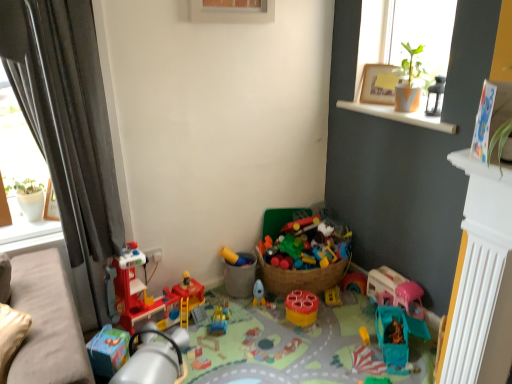
Locate an element on the screen. The width and height of the screenshot is (512, 384). free space behind translucent plastic slide at center, which is the second toy from left to right is located at coordinates (225, 301).